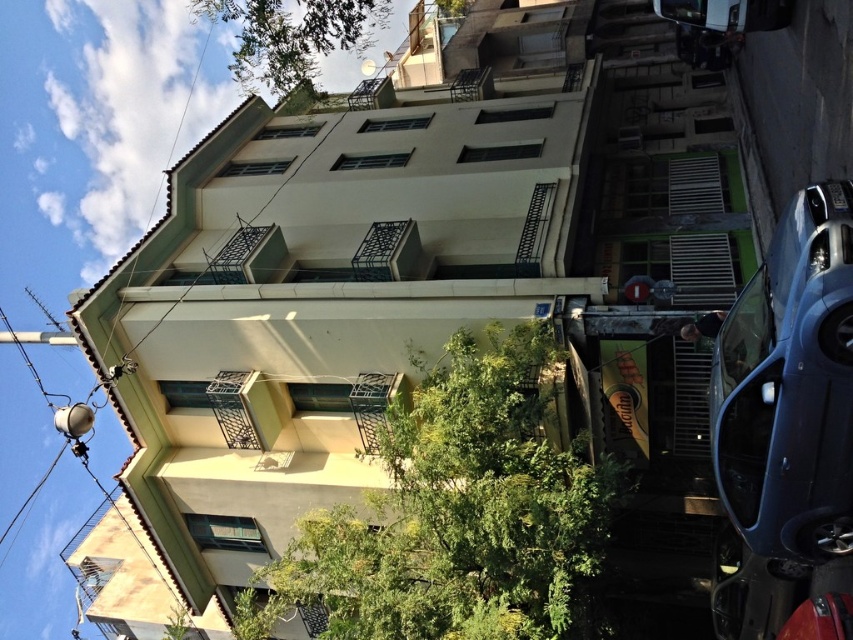
You are standing on the sidewalk in front of the residential building and see the green leafy tree at center and the green leafy tree at upper center. Which tree is closer to you?

The green leafy tree at center is closer to you because it is in front of the green leafy tree at upper center.

From the picture: You are standing in front of the residential building and notice the metallic blue sedan at right and the green leafy tree at upper center. Which object is positioned further to the right side of the image?

The metallic blue sedan at right is positioned to the right of the green leafy tree at upper center, so it is further to the right side of the image.